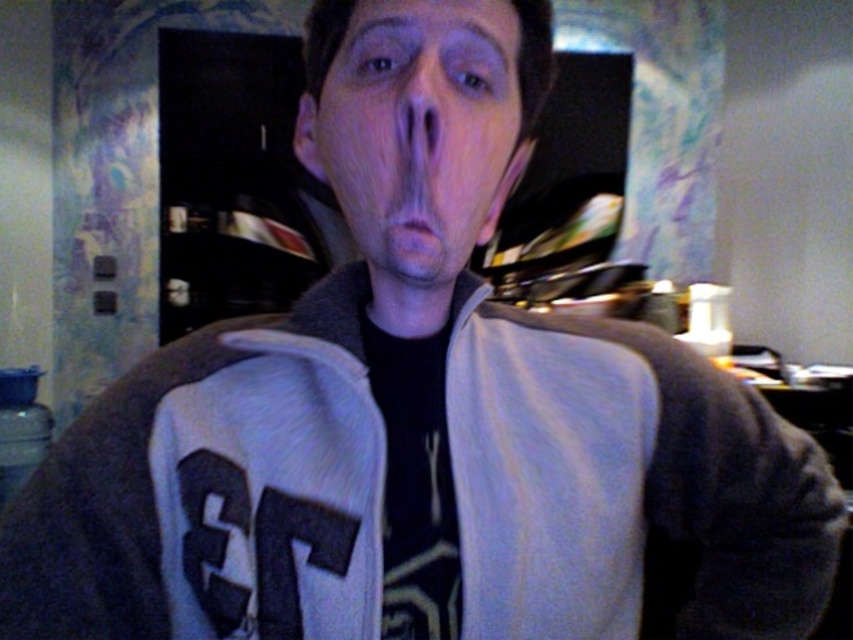
Between matte skin face at center and smooth skin nose at center, which one has less height?

smooth skin nose at center is shorter.

Is matte skin face at center taller than smooth skin nose at center?

Yes.

What do you see at coordinates (419, 129) in the screenshot?
I see `matte skin face at center` at bounding box center [419, 129].

Find the location of a particular element. This screenshot has width=853, height=640. matte skin face at center is located at coordinates (419, 129).

Is smooth skin nose at center to the left of pink matte lips at center from the viewer's perspective?

Incorrect, smooth skin nose at center is not on the left side of pink matte lips at center.

Is smooth skin nose at center further to the viewer compared to pink matte lips at center?

Yes.

Is point (410, 145) farther from viewer compared to point (432, 237)?

That is False.

At what (x,y) coordinates should I click in order to perform the action: click on smooth skin nose at center. Please return your answer as a coordinate pair (x, y). The width and height of the screenshot is (853, 640). Looking at the image, I should click on (419, 116).

Does matte skin face at center have a larger size compared to pink matte lips at center?

Yes.

Where is `matte skin face at center`? This screenshot has width=853, height=640. matte skin face at center is located at coordinates tap(419, 129).

Find the location of a particular element. Image resolution: width=853 pixels, height=640 pixels. matte skin face at center is located at coordinates (419, 129).